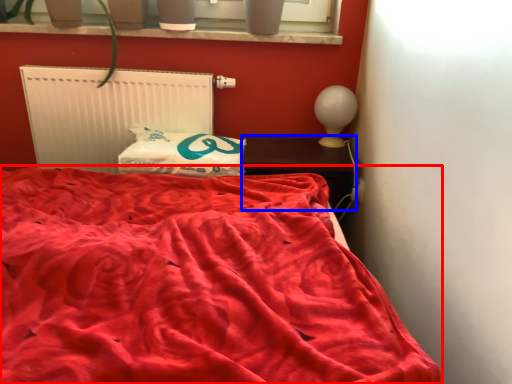
Question: Which of the following is the farthest to the observer, bed (highlighted by a red box) or furniture (highlighted by a blue box)?

Choices:
 (A) bed
 (B) furniture

Answer: (B)